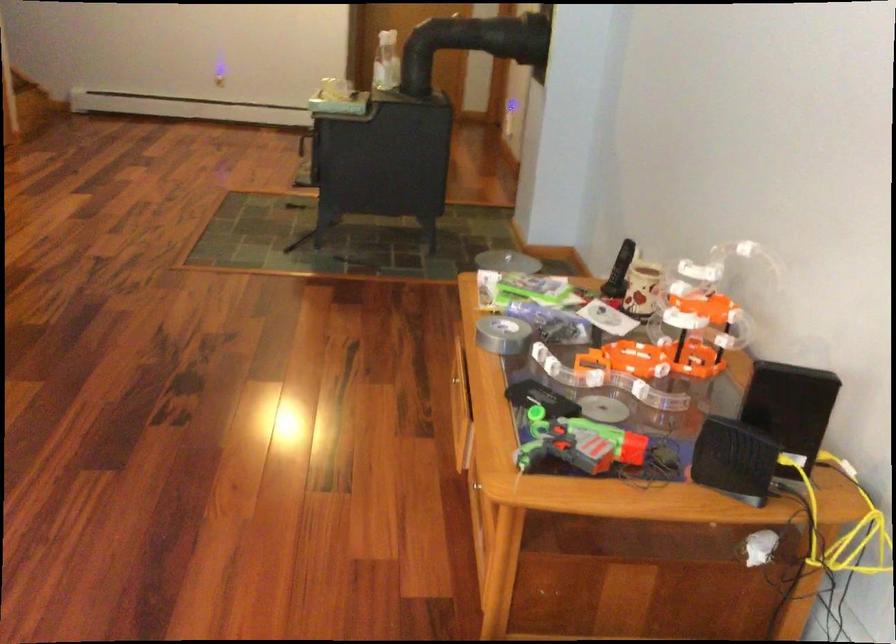
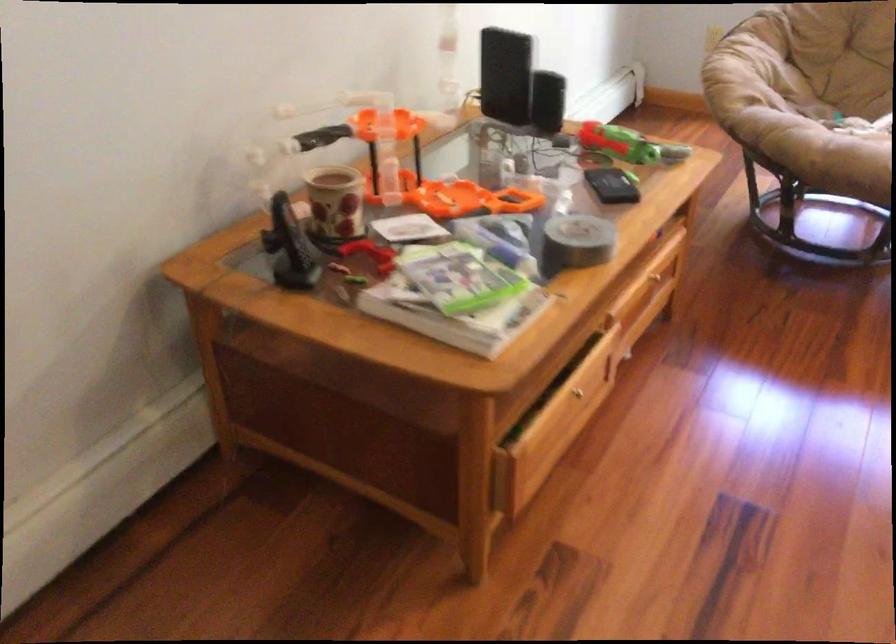
The point at (636, 277) is marked in the first image. Where is the corresponding point in the second image?

(334, 203)